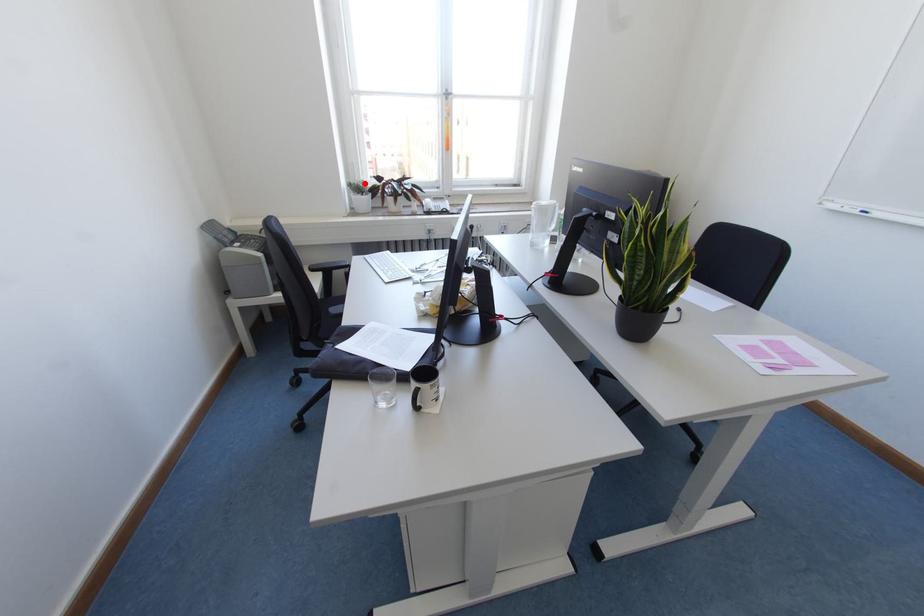
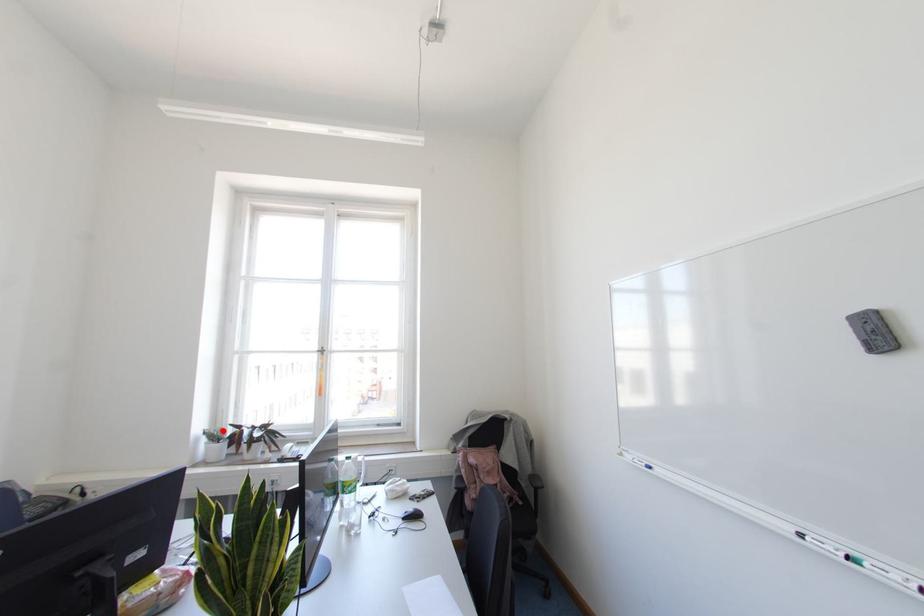
I am providing you with two images of the same scene from different viewpoints. A red point is marked on the first image and another point is marked on the second image. Do the highlighted points in image1 and image2 indicate the same real-world spot?

Yes